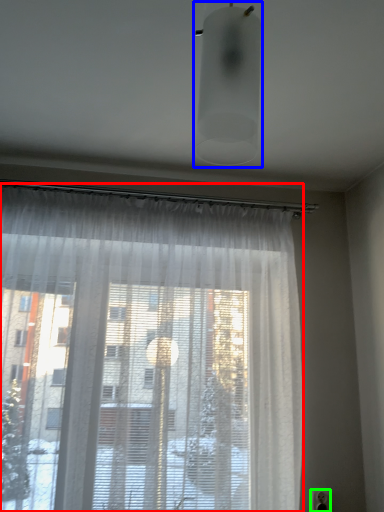
Question: Which object is positioned farthest from curtain (highlighted by a red box)? Select from light fixture (highlighted by a blue box) and electric outlet (highlighted by a green box).

Choices:
 (A) light fixture
 (B) electric outlet

Answer: (B)